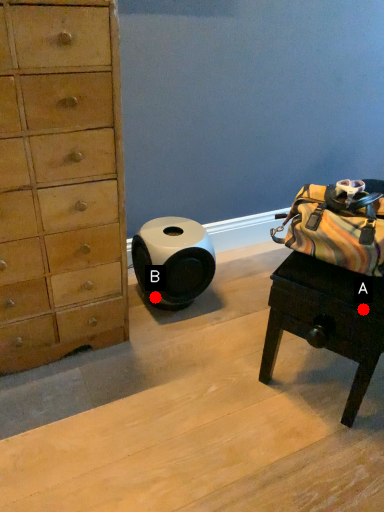
Question: Two points are circled on the image, labeled by A and B beside each circle. Which point is farther to the camera?

Choices:
 (A) A is further
 (B) B is further

Answer: (B)